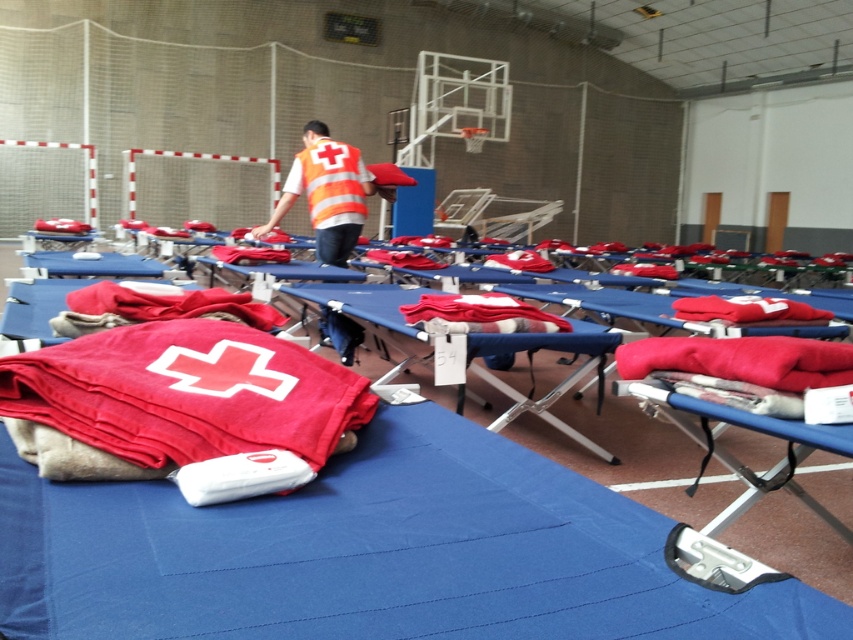
Question: Among these points, which one is nearest to the camera?

Choices:
 (A) (361, 211)
 (B) (334, 156)
 (C) (270, 404)

Answer: (C)

Question: Observing the image, what is the correct spatial positioning of blue fabric cot at center in reference to red cotton cloth at center?

Choices:
 (A) above
 (B) below

Answer: (B)

Question: Does red cotton blanket at lower left appear over red fabric at center?

Choices:
 (A) no
 (B) yes

Answer: (A)

Question: Is orange reflective vest at center behind red cotton blanket at lower left?

Choices:
 (A) no
 (B) yes

Answer: (B)

Question: Based on their relative distances, which object is farther from the orange reflective vest at center?

Choices:
 (A) orange reflective safety vest at center
 (B) red soft fabric at center
 (C) red cotton blanket at lower left
 (D) red cotton cloth at center

Answer: (B)

Question: Based on their relative distances, which object is farther from the red soft fabric at center?

Choices:
 (A) red soft blanket at center
 (B) red fabric at center
 (C) red cotton cloth at center

Answer: (B)